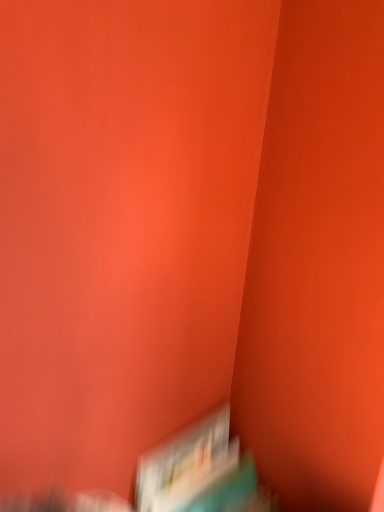
The height and width of the screenshot is (512, 384). What do you see at coordinates (200, 472) in the screenshot? I see `teal matte book at lower right` at bounding box center [200, 472].

You are a GUI agent. You are given a task and a screenshot of the screen. Output one action in this format:
    pyautogui.click(x=<x>, y=<y>)
    Task: Click on the teal matte book at lower right
    The height and width of the screenshot is (512, 384).
    Given the screenshot: What is the action you would take?
    pyautogui.click(x=200, y=472)

The image size is (384, 512). I want to click on teal matte book at lower right, so click(200, 472).